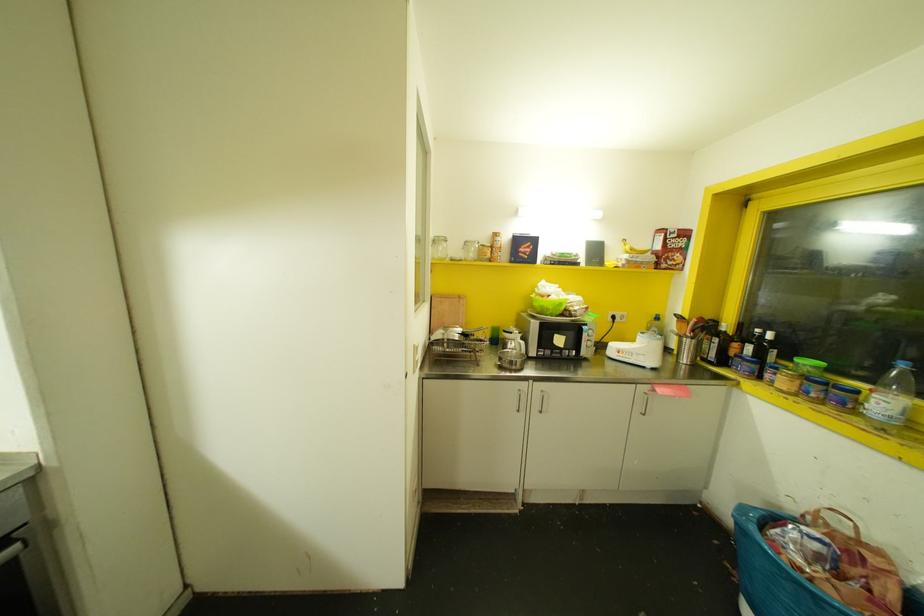
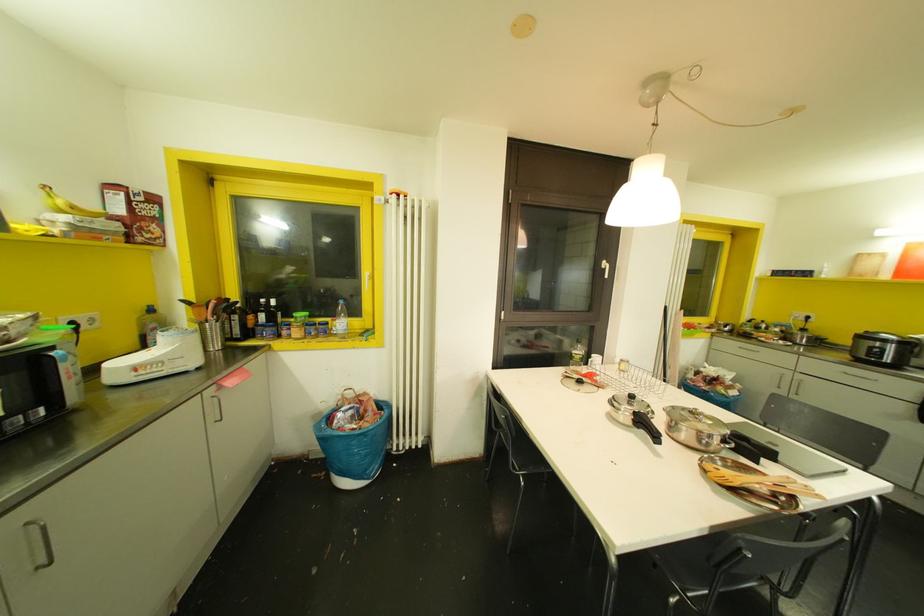
Find the pixel in the second image that matches [610,352] in the first image.

(116, 378)